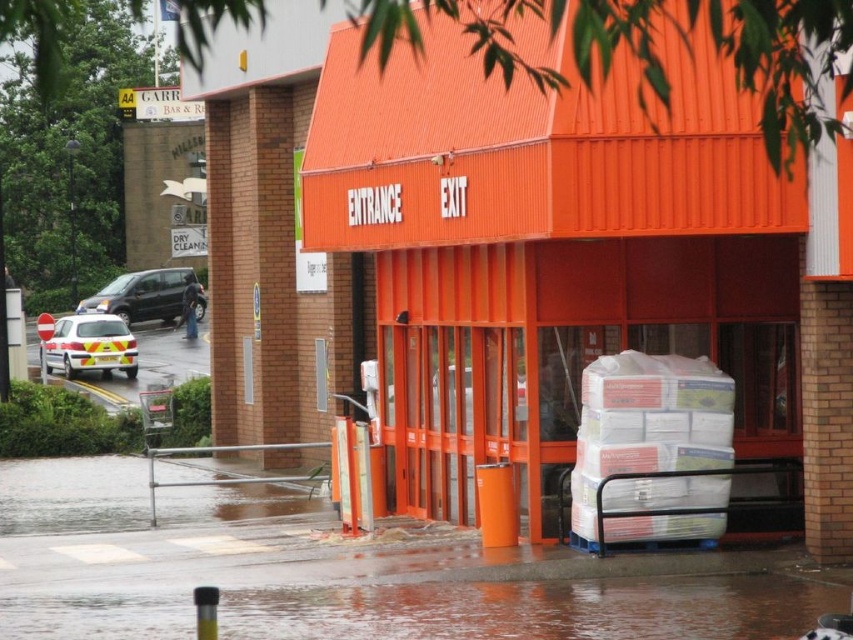
Question: Is wet concrete flood at lower center above wet concrete flood at lower left?

Choices:
 (A) yes
 (B) no

Answer: (B)

Question: From the image, what is the correct spatial relationship of wet concrete flood at lower left in relation to yellow reflective plastic ambulance at left?

Choices:
 (A) right
 (B) left

Answer: (A)

Question: Which point is farther to the camera?

Choices:
 (A) yellow reflective plastic ambulance at left
 (B) matte black suv at left
 (C) wet concrete flood at lower left

Answer: (B)

Question: Estimate the real-world distances between objects in this image. Which object is closer to the wet concrete flood at lower left?

Choices:
 (A) wet concrete flood at lower center
 (B) matte black suv at left

Answer: (A)

Question: Which point is closer to the camera taking this photo?

Choices:
 (A) (62, 340)
 (B) (187, 465)
 (C) (140, 282)

Answer: (B)

Question: Is wet concrete flood at lower center above wet concrete flood at lower left?

Choices:
 (A) no
 (B) yes

Answer: (A)